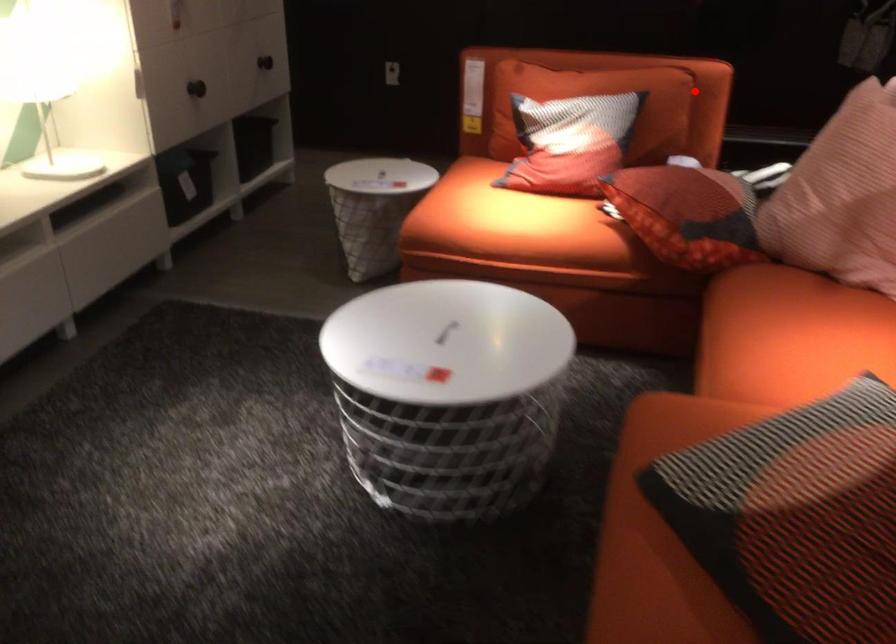
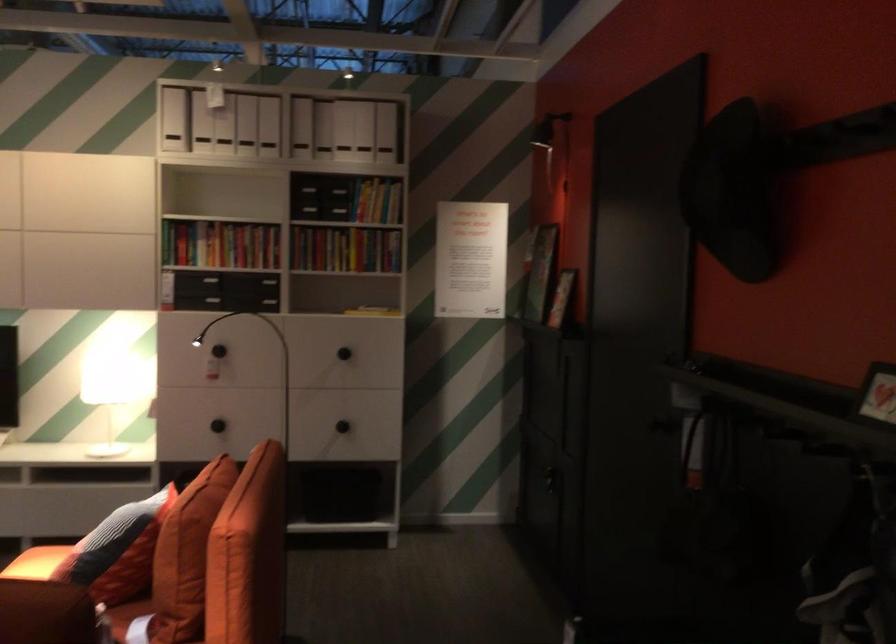
Question: I am providing you with two images of the same scene from different viewpoints. Given a red point in image1, look at the same physical point in image2. Is it:

Choices:
 (A) Closer to the viewpoint
 (B) Farther from the viewpoint

Answer: (A)